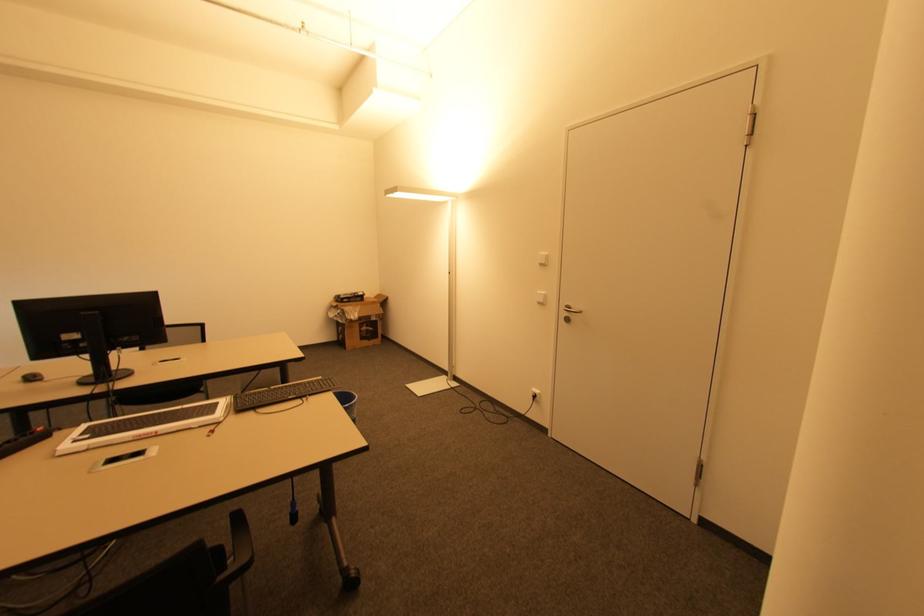
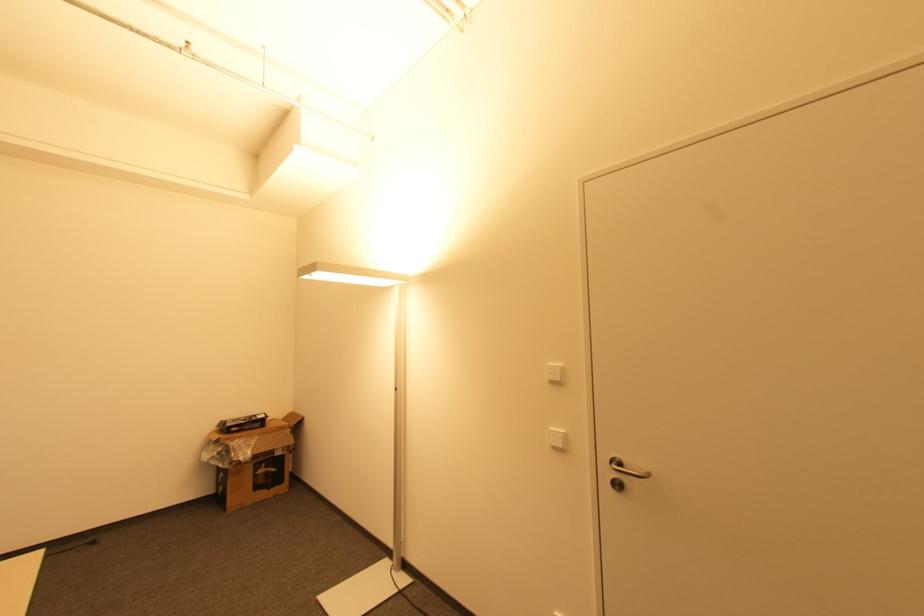
Where in the second image is the point corresponding to (565,312) from the first image?

(613, 469)